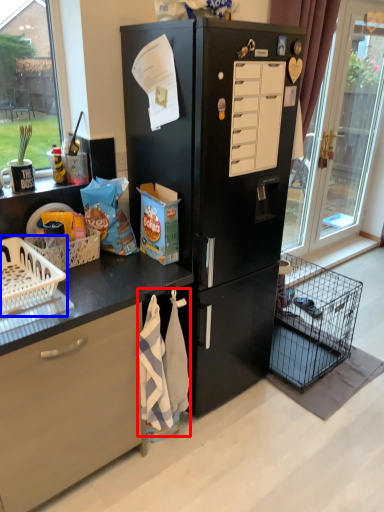
Question: Which point is further to the camera, material (highlighted by a red box) or basket (highlighted by a blue box)?

Choices:
 (A) material
 (B) basket

Answer: (A)